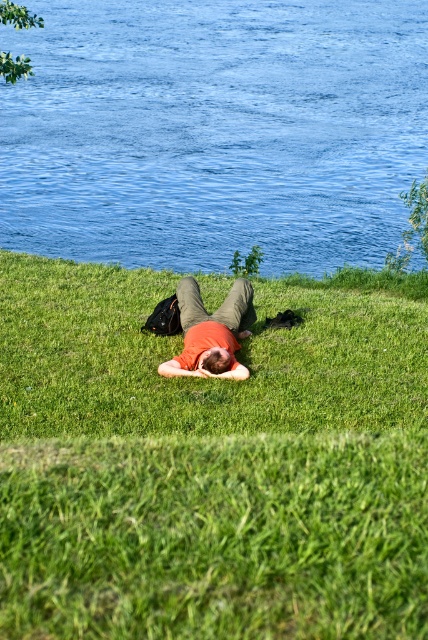
Question: Which object is positioned farthest from the blue liquid water at upper center?

Choices:
 (A) green grassy at center
 (B) orange cotton shirt at center

Answer: (A)

Question: Among these points, which one is nearest to the camera?

Choices:
 (A) (80, 113)
 (B) (192, 369)

Answer: (B)

Question: Is green grassy at center wider than blue liquid water at upper center?

Choices:
 (A) no
 (B) yes

Answer: (A)

Question: Can you confirm if blue liquid water at upper center is wider than orange cotton shirt at center?

Choices:
 (A) no
 (B) yes

Answer: (B)

Question: Does green grassy at center appear under blue liquid water at upper center?

Choices:
 (A) no
 (B) yes

Answer: (B)

Question: Which point is closer to the camera taking this photo?

Choices:
 (A) (306, 385)
 (B) (222, 368)
 (C) (363, 227)

Answer: (B)